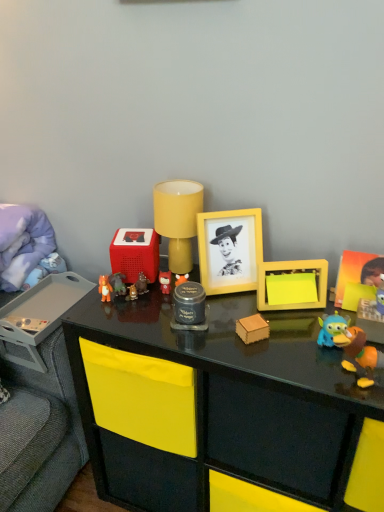
Question: Can we say metallic gray tray at left lies outside wooden block at center, which is the eighth toy in left-to-right order?

Choices:
 (A) yes
 (B) no

Answer: (A)

Question: Is the depth of metallic gray tray at left less than that of wooden block at center, which is the eighth toy in left-to-right order?

Choices:
 (A) no
 (B) yes

Answer: (A)

Question: Does metallic gray tray at left appear on the right side of wooden block at center, which is the eighth toy in left-to-right order?

Choices:
 (A) no
 (B) yes

Answer: (A)

Question: Is metallic gray tray at left to the left of wooden block at center, which is counted as the fourth toy, starting from the right, from the viewer's perspective?

Choices:
 (A) no
 (B) yes

Answer: (B)

Question: Does metallic gray tray at left have a lesser height compared to wooden block at center, which is the eighth toy in left-to-right order?

Choices:
 (A) no
 (B) yes

Answer: (A)

Question: From a real-world perspective, is metallic gray tray at left over wooden block at center, which is counted as the fourth toy, starting from the right?

Choices:
 (A) yes
 (B) no

Answer: (B)

Question: Is orange rubber toy at right, which ranks as the first toy in right-to-left order, thinner than yellow matte sticky notes at center-right, marked as the ninth toy in a left-to-right arrangement?

Choices:
 (A) no
 (B) yes

Answer: (A)

Question: Are orange rubber toy at right, the 11th toy positioned from the left, and yellow matte sticky notes at center-right, marked as the ninth toy in a left-to-right arrangement, making contact?

Choices:
 (A) no
 (B) yes

Answer: (A)

Question: Is orange rubber toy at right, which ranks as the first toy in right-to-left order, aimed at yellow matte sticky notes at center-right, marked as the ninth toy in a left-to-right arrangement?

Choices:
 (A) no
 (B) yes

Answer: (A)

Question: Can you confirm if orange rubber toy at right, which ranks as the first toy in right-to-left order, is taller than yellow matte sticky notes at center-right, marked as the ninth toy in a left-to-right arrangement?

Choices:
 (A) yes
 (B) no

Answer: (B)

Question: Is orange rubber toy at right, the 11th toy positioned from the left, not near yellow matte sticky notes at center-right, marked as the 3th toy in a right-to-left arrangement?

Choices:
 (A) yes
 (B) no

Answer: (B)

Question: Considering the relative sizes of orange rubber toy at right, which ranks as the first toy in right-to-left order, and yellow matte sticky notes at center-right, marked as the 3th toy in a right-to-left arrangement, in the image provided, is orange rubber toy at right, which ranks as the first toy in right-to-left order, smaller than yellow matte sticky notes at center-right, marked as the 3th toy in a right-to-left arrangement,?

Choices:
 (A) yes
 (B) no

Answer: (B)

Question: Would you say matte plastic toy at center, positioned as the 2th toy in left-to-right order, is outside yellow matte table lamp at center?

Choices:
 (A) no
 (B) yes

Answer: (B)